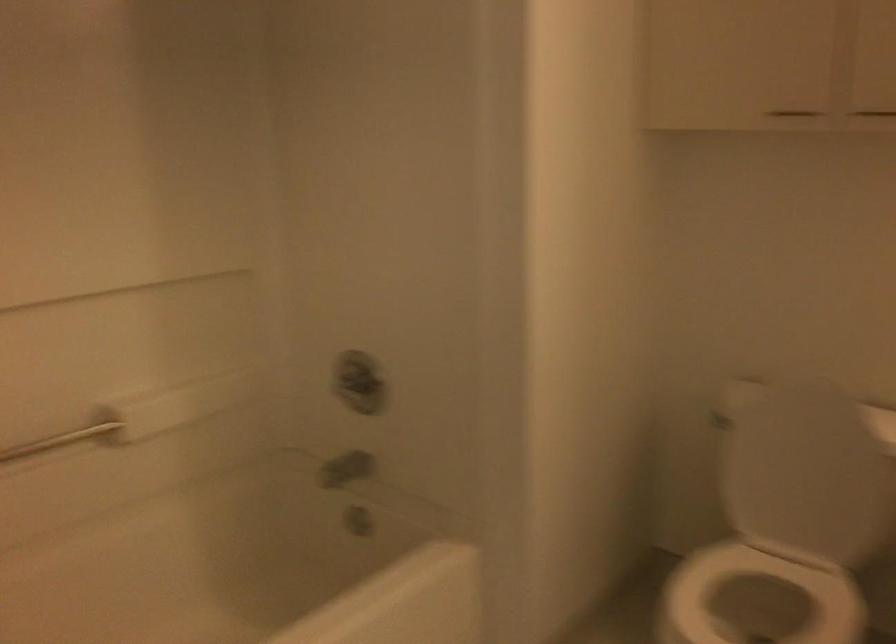
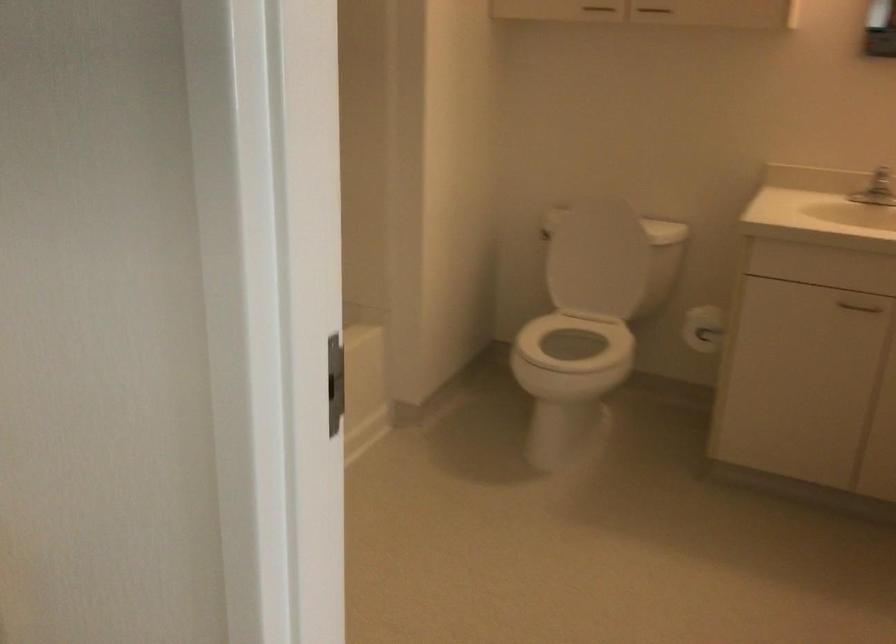
The point at (x=800, y=460) is marked in the first image. Where is the corresponding point in the second image?

(596, 258)